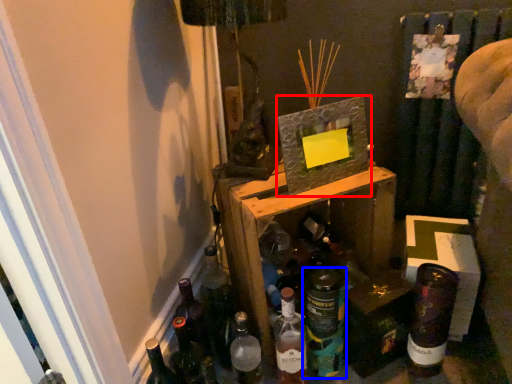
Question: Which object appears closest to the camera in this image, picture frame (highlighted by a red box) or bottle (highlighted by a blue box)?

Choices:
 (A) picture frame
 (B) bottle

Answer: (A)